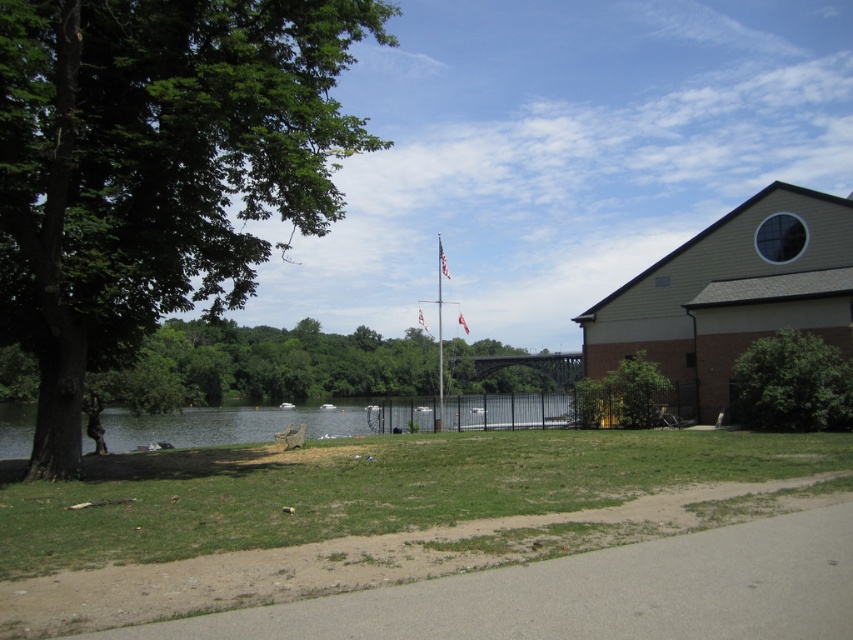
Question: Based on their relative distances, which object is nearer to the metallic flag pole at center?

Choices:
 (A) red fabric flag at center
 (B) green grassy lake at center

Answer: (A)

Question: Which point is farther from the camera taking this photo?

Choices:
 (A) (793, 385)
 (B) (463, 320)

Answer: (B)

Question: Is american flag at center above white fabric flag at center?

Choices:
 (A) no
 (B) yes

Answer: (B)

Question: Which of these objects is positioned farthest from the metallic flag pole at center?

Choices:
 (A) green leafy tree at center
 (B) white fabric flag at center
 (C) green leafy tree at right

Answer: (A)

Question: Can you confirm if american flag at center is positioned to the right of white fabric flag at center?

Choices:
 (A) yes
 (B) no

Answer: (A)

Question: Is green leafy tree at left to the right of green leafy tree at right from the viewer's perspective?

Choices:
 (A) no
 (B) yes

Answer: (A)